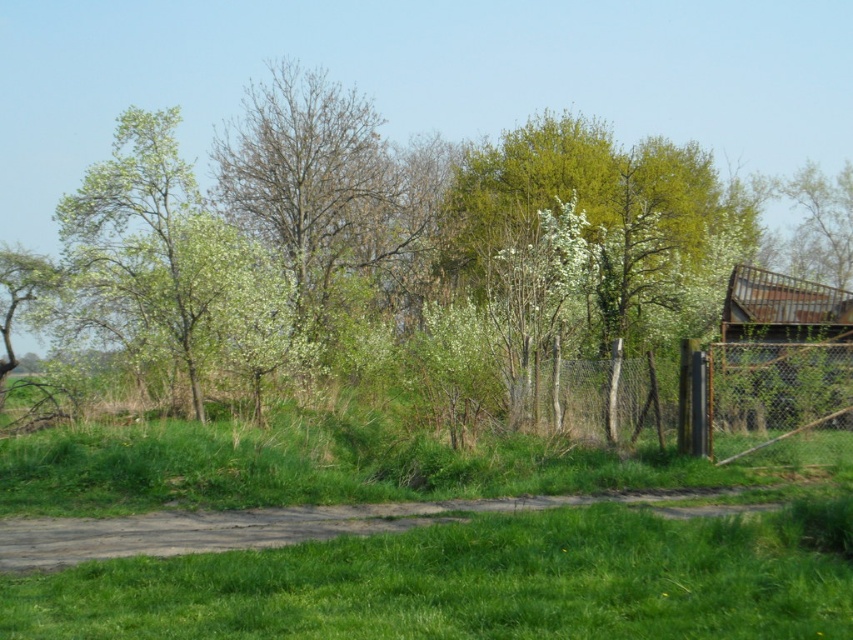
Question: Does green leafy tree at center have a smaller size compared to metallic chain-link fence at right?

Choices:
 (A) yes
 (B) no

Answer: (B)

Question: Does green leafy tree at center appear on the left side of metallic chain-link fence at right?

Choices:
 (A) yes
 (B) no

Answer: (A)

Question: Which of the following is the closest to the observer?

Choices:
 (A) (538, 241)
 (B) (801, 452)
 (C) (215, 328)

Answer: (B)

Question: Is green leafy tree at center positioned at the back of metallic chain-link fence at right?

Choices:
 (A) yes
 (B) no

Answer: (B)

Question: Which point appears closest to the camera in this image?

Choices:
 (A) (142, 193)
 (B) (810, 451)
 (C) (728, 320)

Answer: (B)

Question: Which point is closer to the camera?

Choices:
 (A) (326, 92)
 (B) (567, 394)

Answer: (B)